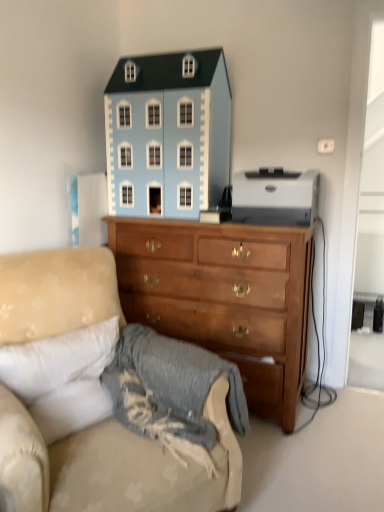
Question: From the image's perspective, is light blue painted wood dollhouse at upper center, marked as the 1th toy in a left-to-right arrangement, above or below white glossy printer at upper right, which is counted as the 2th toy, starting from the left?

Choices:
 (A) above
 (B) below

Answer: (A)

Question: Is light blue painted wood dollhouse at upper center, which is the 2th toy in right-to-left order, taller or shorter than white glossy printer at upper right, which is counted as the 2th toy, starting from the left?

Choices:
 (A) tall
 (B) short

Answer: (A)

Question: Which object is positioned farthest from the white glossy printer at upper right, which is counted as the 2th toy, starting from the left?

Choices:
 (A) light blue painted wood dollhouse at upper center, which is the 2th toy in right-to-left order
 (B) beige fabric couch at lower left
 (C) wooden chest of drawers at center

Answer: (B)

Question: Which is nearer to the light blue painted wood dollhouse at upper center, marked as the 1th toy in a left-to-right arrangement?

Choices:
 (A) white glossy printer at upper right, the first toy in the right-to-left sequence
 (B) beige fabric couch at lower left
 (C) wooden chest of drawers at center

Answer: (C)